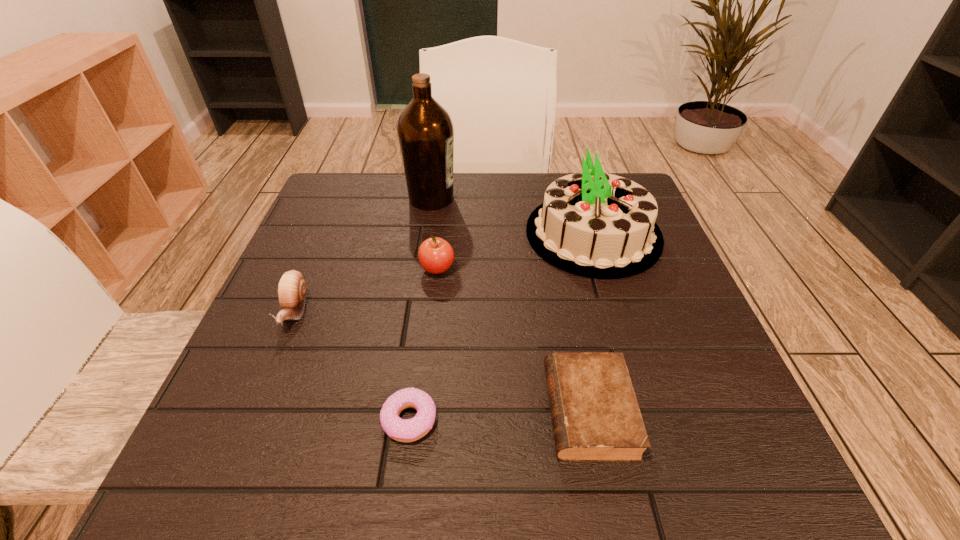
The width and height of the screenshot is (960, 540). Identify the location of vacant space that satisfies the following two spatial constraints: 1. on the label of the tallest object; 2. on the back side of the birthday cake. (426, 234).

Where is `blank space that satisfies the following two spatial constraints: 1. on the front-facing side of the leftmost object; 2. on the right side of the doughnut`? The image size is (960, 540). blank space that satisfies the following two spatial constraints: 1. on the front-facing side of the leftmost object; 2. on the right side of the doughnut is located at coordinates (250, 419).

Identify the location of free region that satisfies the following two spatial constraints: 1. on the label of the olive oil; 2. on the front-facing side of the fourth farthest object. (415, 310).